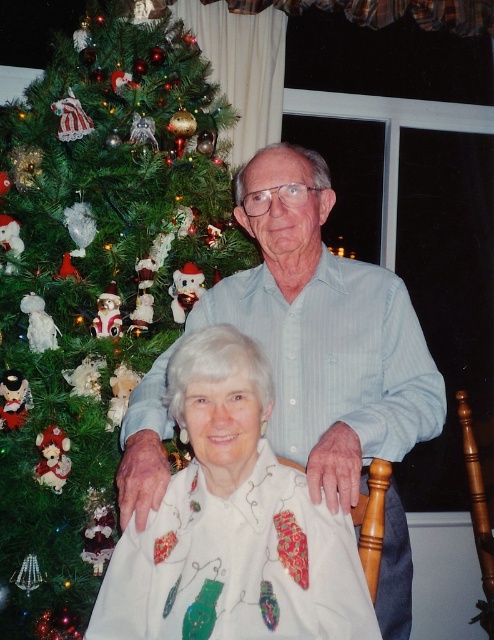
Does light blue striped shirt at center have a greater width compared to white satin blouse at center?

Correct, the width of light blue striped shirt at center exceeds that of white satin blouse at center.

Between light blue striped shirt at center and white satin blouse at center, which one appears on the right side from the viewer's perspective?

Positioned to the right is light blue striped shirt at center.

Between point (399, 307) and point (294, 529), which one is positioned behind?

The point (399, 307) is behind.

You are a GUI agent. You are given a task and a screenshot of the screen. Output one action in this format:
    pyautogui.click(x=<x>, y=<y>)
    Task: Click on the light blue striped shirt at center
    This screenshot has height=640, width=494.
    Given the screenshot: What is the action you would take?
    pyautogui.click(x=325, y=332)

Which is more to the right, green matte christmas tree at left or light blue striped shirt at center?

Positioned to the right is light blue striped shirt at center.

Is green matte christmas tree at left bigger than light blue striped shirt at center?

Yes.

Locate an element on the screen. green matte christmas tree at left is located at coordinates pyautogui.click(x=95, y=285).

Measure the distance between green matte christmas tree at left and white satin blouse at center.

green matte christmas tree at left is 35.90 inches from white satin blouse at center.

Looking at this image, who is more distant from viewer, [77,40] or [200,556]?

The point [77,40] is more distant.

Is point (51, 280) closer to camera compared to point (302, 611)?

No.

What are the coordinates of `green matte christmas tree at left` in the screenshot? It's located at (95, 285).